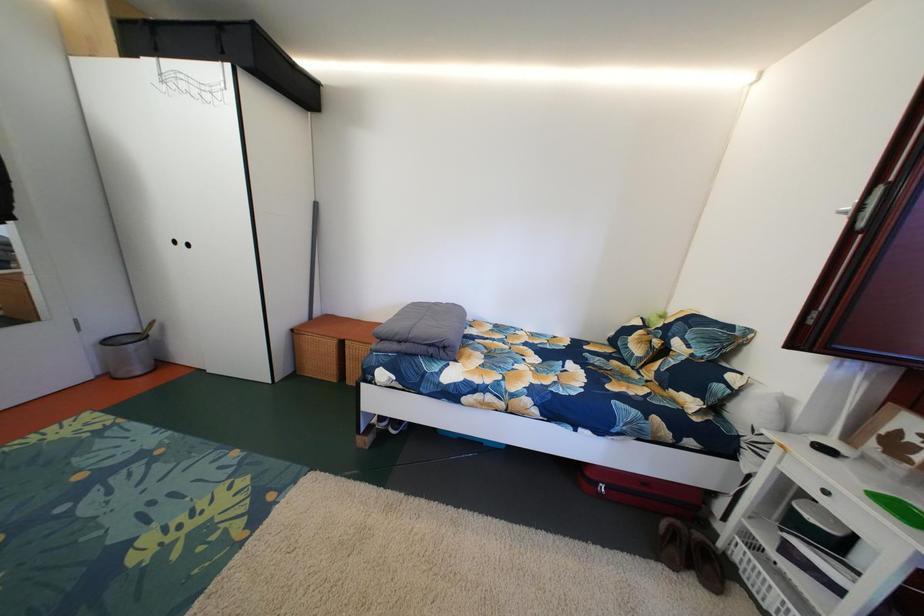
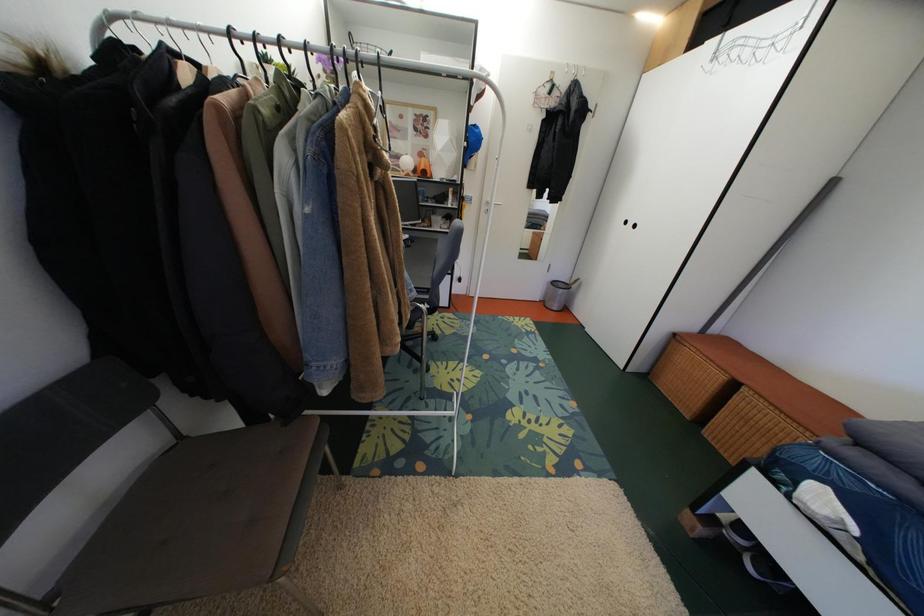
The first image is from the beginning of the video and the second image is from the end. How did the camera likely rotate when shooting the video?

The camera's rotation is toward left-down.